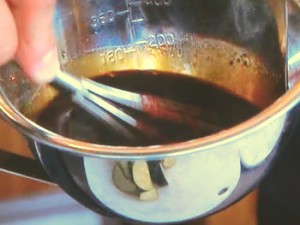
This screenshot has height=225, width=300. In order to click on handle in this screenshot , I will do `click(25, 165)`.